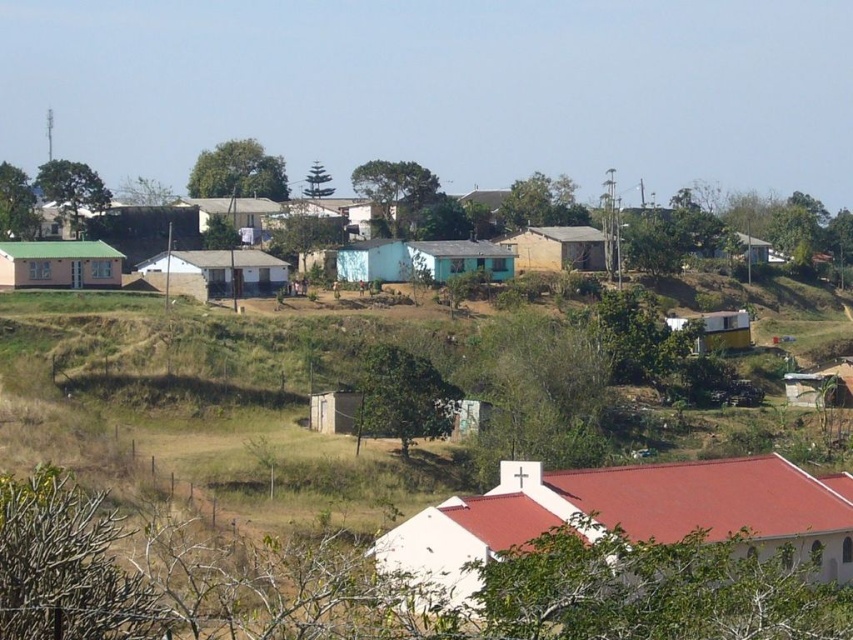
Which is more to the right, light blue painted wood house at center or light brown corrugated metal hut at center?

light brown corrugated metal hut at center is more to the right.

Is light blue painted wood house at center shorter than light brown corrugated metal hut at center?

Correct, light blue painted wood house at center is not as tall as light brown corrugated metal hut at center.

Does point (416, 250) come behind point (579, 257)?

No, (416, 250) is in front of (579, 257).

Identify the location of light blue painted wood house at center. (422, 260).

Consider the image. Does white matte church at lower center have a lesser height compared to light brown wooden hut at upper right?

Incorrect, white matte church at lower center's height does not fall short of light brown wooden hut at upper right's.

At what (x,y) coordinates should I click in order to perform the action: click on white matte church at lower center. Please return your answer as a coordinate pair (x, y). This screenshot has height=640, width=853. Looking at the image, I should click on (624, 516).

You are a GUI agent. You are given a task and a screenshot of the screen. Output one action in this format:
    pyautogui.click(x=<x>, y=<y>)
    Task: Click on the white matte church at lower center
    
    Given the screenshot: What is the action you would take?
    pyautogui.click(x=624, y=516)

Who is higher up, white matte church at lower center or white plastic hut at right?

Positioned higher is white plastic hut at right.

Can you confirm if white matte church at lower center is positioned below white plastic hut at right?

Correct, white matte church at lower center is located below white plastic hut at right.

Identify the location of white matte church at lower center. The height and width of the screenshot is (640, 853). (624, 516).